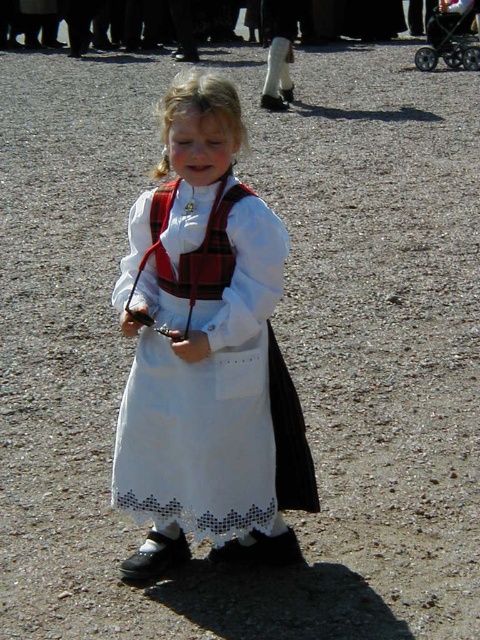
Question: Can you confirm if white cotton dress at center is smaller than black plastic baby carriage at upper right?

Choices:
 (A) no
 (B) yes

Answer: (B)

Question: Can you confirm if white cotton dress at center is positioned below black plastic baby carriage at upper right?

Choices:
 (A) no
 (B) yes

Answer: (B)

Question: Which object appears farthest from the camera in this image?

Choices:
 (A) white cotton dress at center
 (B) black plastic baby carriage at upper right

Answer: (B)

Question: Is white cotton dress at center to the left of black plastic baby carriage at upper right from the viewer's perspective?

Choices:
 (A) no
 (B) yes

Answer: (B)